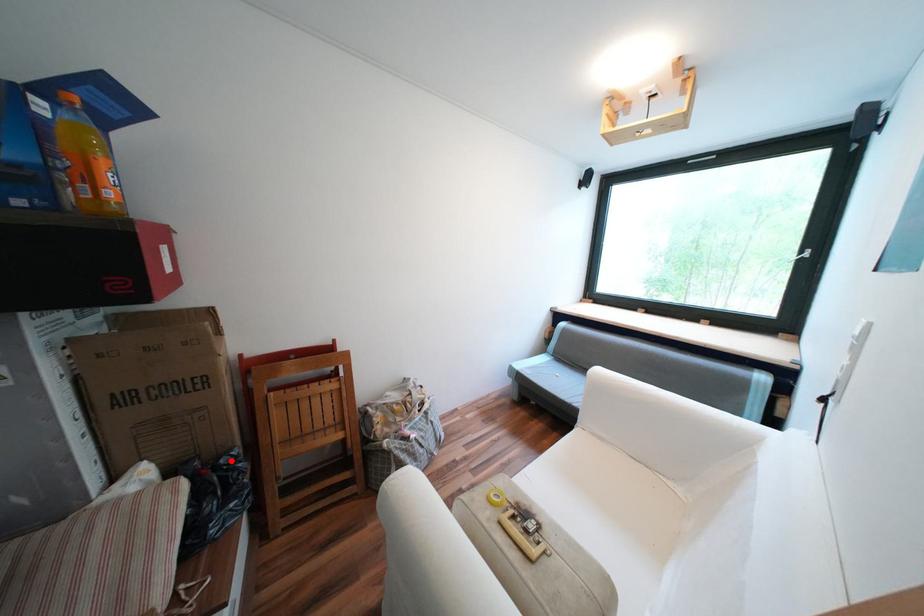
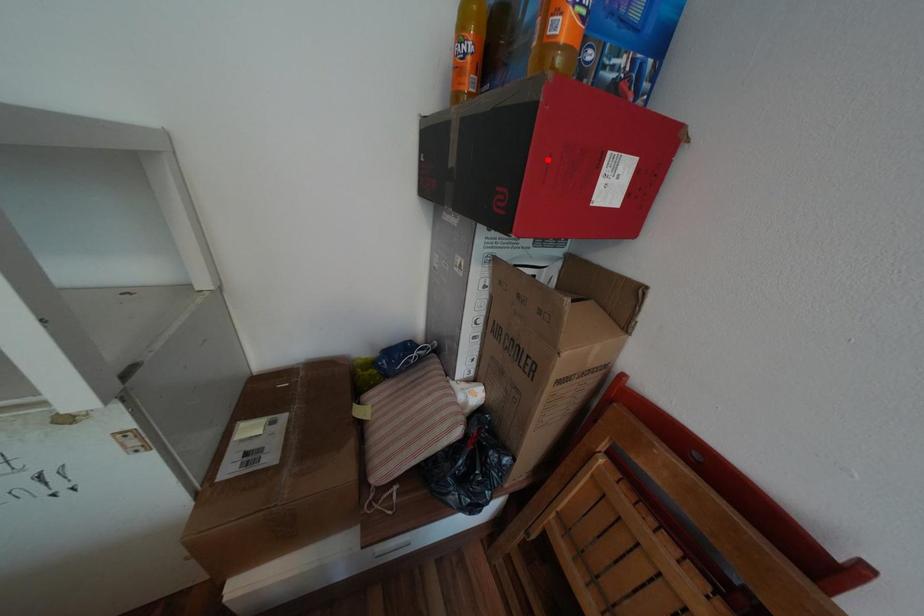
I am providing you with two images of the same scene from different viewpoints. A red point is marked on the first image and another point is marked on the second image. Is the marked point in image1 the same physical position as the marked point in image2?

No